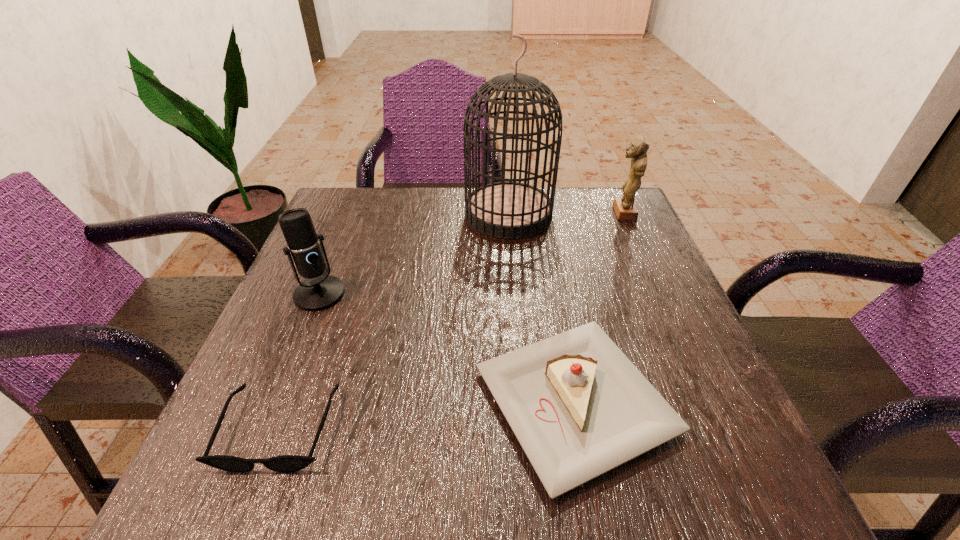
You are a GUI agent. You are given a task and a screenshot of the screen. Output one action in this format:
    pyautogui.click(x=<x>, y=<y>)
    Task: Click on the free location that satisfies the following two spatial constraints: 1. on the front-facing side of the rightmost object; 2. on the front-facing side of the shortest object
    Image resolution: width=960 pixels, height=540 pixels.
    Given the screenshot: What is the action you would take?
    pyautogui.click(x=718, y=428)